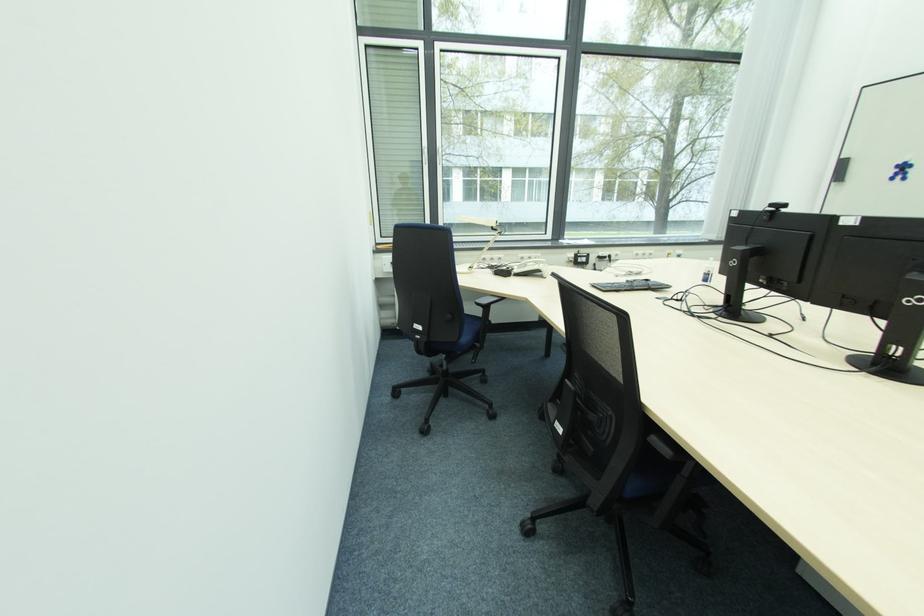
What do you see at coordinates (422, 156) in the screenshot? I see `a window handle` at bounding box center [422, 156].